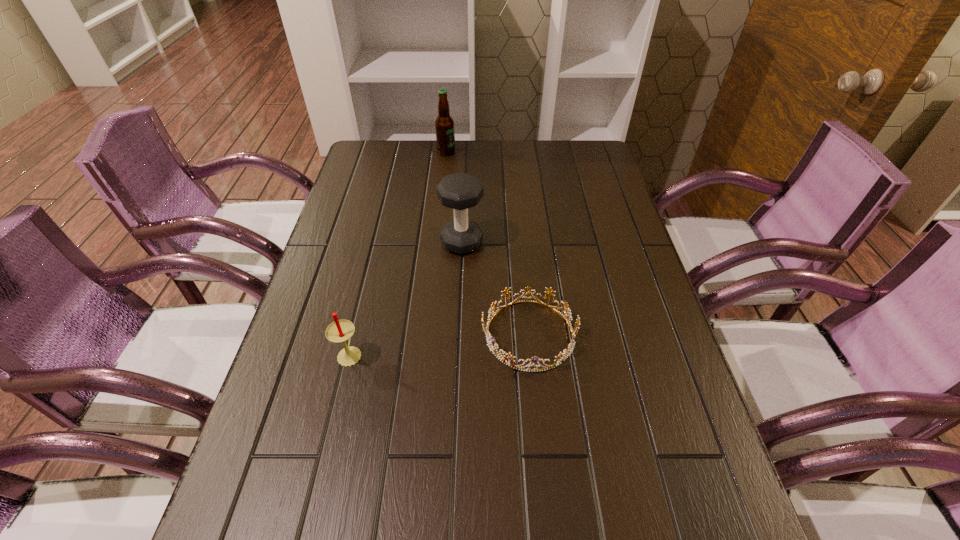
This screenshot has width=960, height=540. What are the coordinates of `blank area in the image that satisfies the following two spatial constraints: 1. on the label of the farthest object; 2. on the left side of the dumbbell` in the screenshot? It's located at (437, 242).